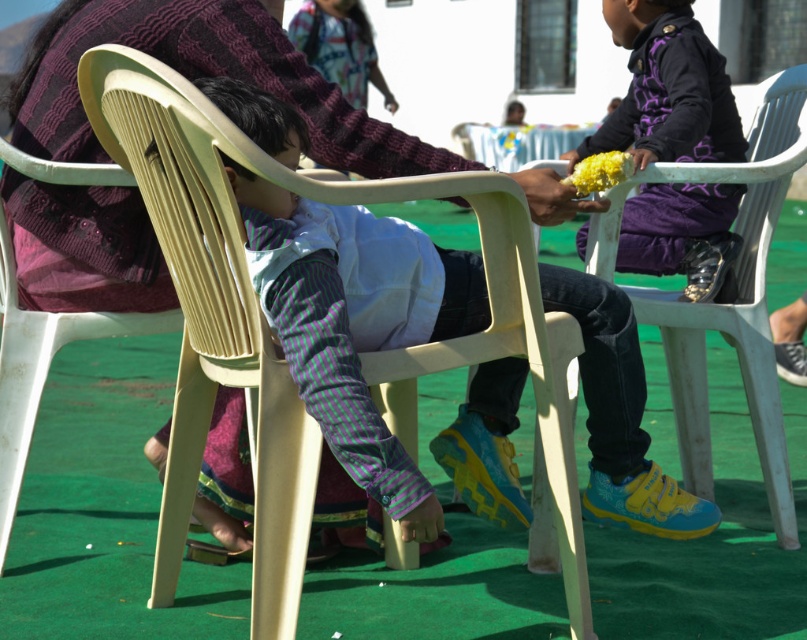
Question: Does purple matte jacket at upper right have a smaller size compared to yellow matte flower at center?

Choices:
 (A) yes
 (B) no

Answer: (B)

Question: Based on their relative distances, which object is farther from the yellow matte flower at center?

Choices:
 (A) matte yellow flower at upper right
 (B) white plastic chair at right
 (C) purple matte jacket at upper right
 (D) beige plastic chair at center

Answer: (D)

Question: Which object appears farthest from the camera in this image?

Choices:
 (A) beige plastic chair at center
 (B) white plastic chair at right
 (C) matte yellow flower at upper right
 (D) purple matte jacket at upper right

Answer: (D)

Question: Which of these objects is positioned farthest from the matte yellow flower at center?

Choices:
 (A) yellow matte flower at center
 (B) white plastic chair at right

Answer: (B)

Question: Is beige plastic chair at center behind yellow matte flower at center?

Choices:
 (A) no
 (B) yes

Answer: (A)

Question: Is matte yellow flower at center thinner than matte yellow flower at upper right?

Choices:
 (A) yes
 (B) no

Answer: (B)